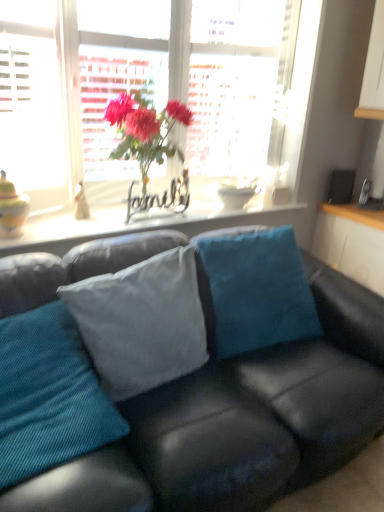
Identify the location of vacant space that's between matte glass vase at center and matte yellow vase at left. The width and height of the screenshot is (384, 512). (86, 227).